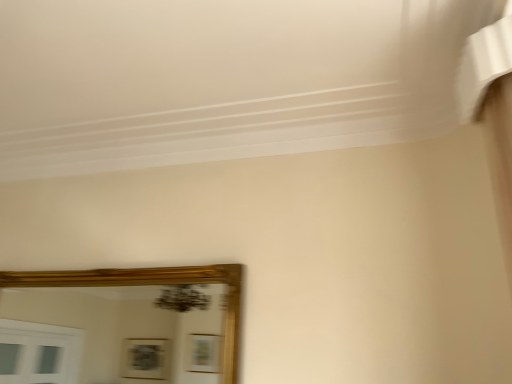
This screenshot has height=384, width=512. Describe the element at coordinates (119, 326) in the screenshot. I see `gold wooden mirror at lower left` at that location.

Find the location of a particular element. The width and height of the screenshot is (512, 384). gold wooden mirror at lower left is located at coordinates (119, 326).

This screenshot has width=512, height=384. Find the location of `gold wooden mirror at lower left`. gold wooden mirror at lower left is located at coordinates (119, 326).